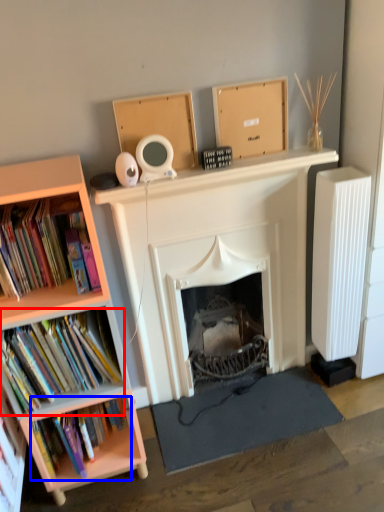
Question: Among these objects, which one is farthest to the camera, book (highlighted by a red box) or book (highlighted by a blue box)?

Choices:
 (A) book
 (B) book

Answer: (B)